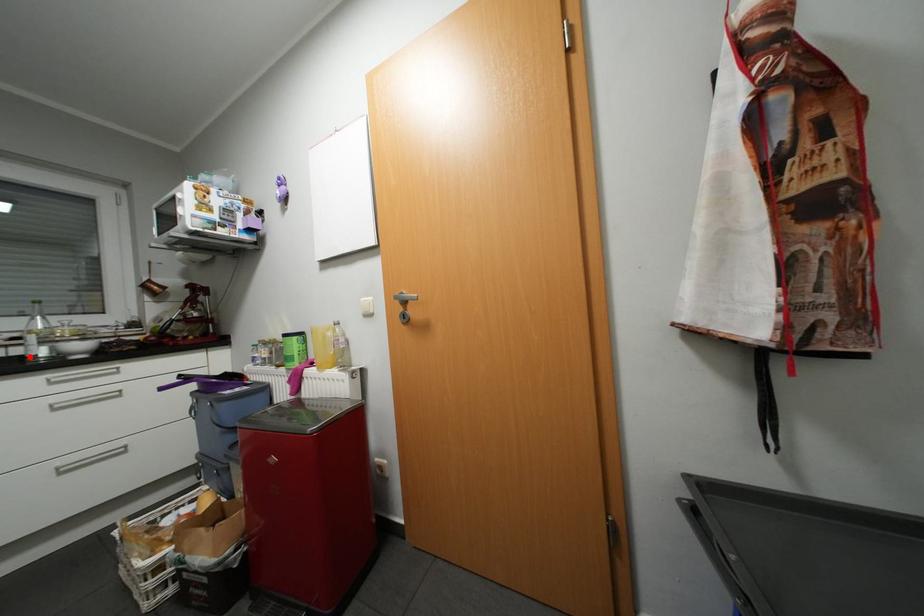
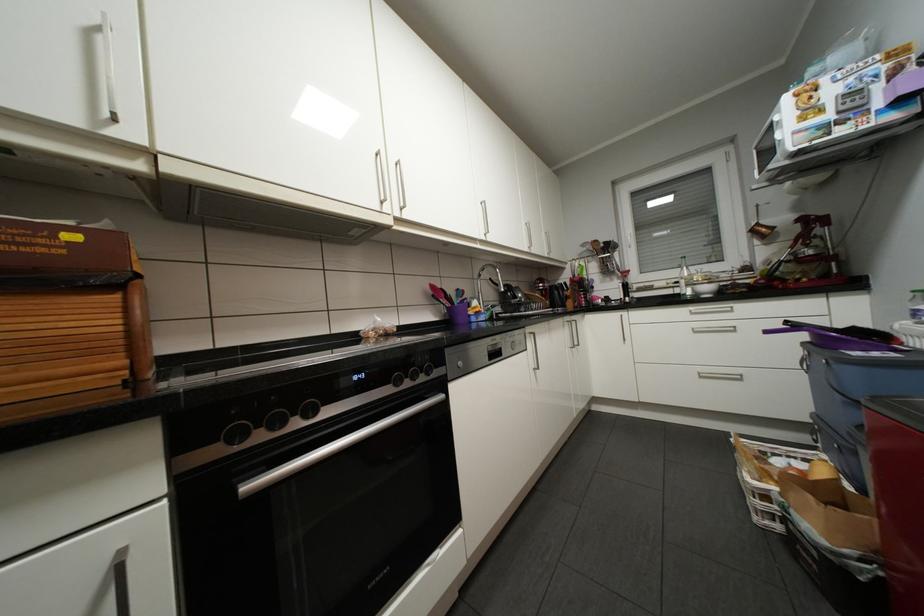
Where in the second image is the point corresponding to the highlighted location from the first image?

(687, 294)